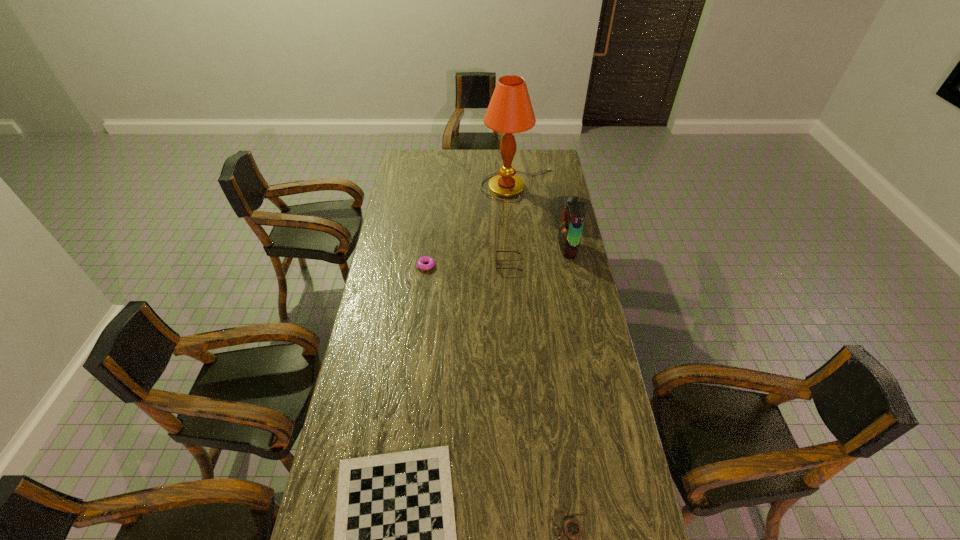
The image size is (960, 540). Identify the location of free spot between the tallest object and the sunglasses. (514, 225).

The image size is (960, 540). What are the coordinates of `vacant area that lies between the sunglasses and the second tallest object` in the screenshot? It's located at (539, 256).

Find the location of a particular element. The height and width of the screenshot is (540, 960). free space between the farthest object and the sunglasses is located at coordinates (514, 225).

The image size is (960, 540). I want to click on the fourth closest object to the doughnut, so click(x=395, y=539).

Identify which object is located as the fifth nearest to the second shortest object. Please provide its 2D coordinates. Your answer should be formatted as a tuple, i.e. [(x, y)], where the tuple contains the x and y coordinates of a point satisfying the conditions above.

[(510, 111)]